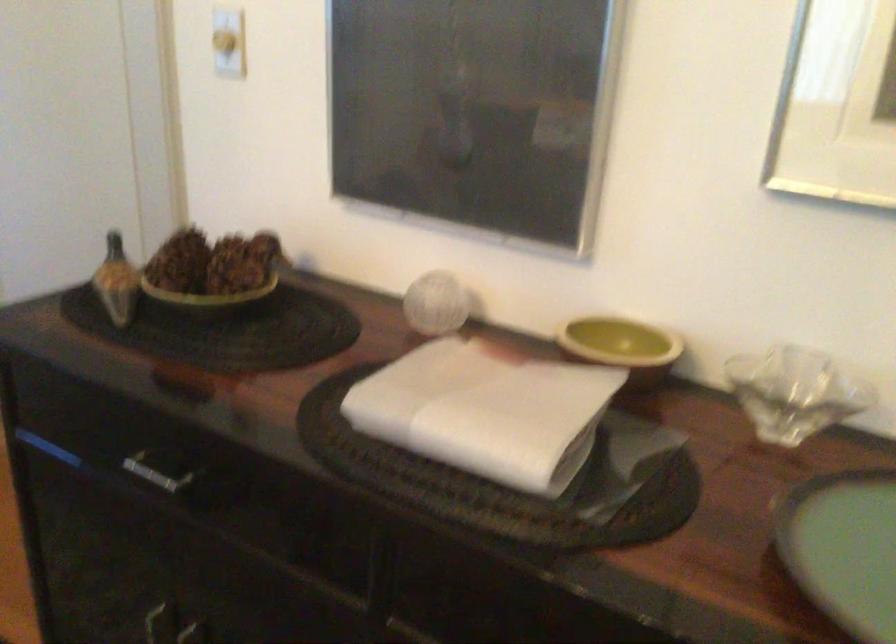
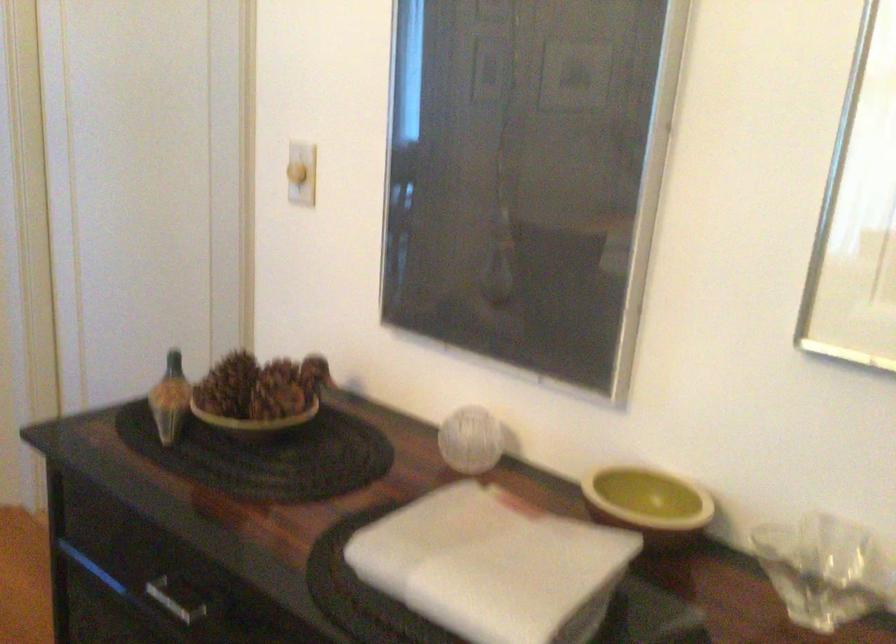
The point at (616, 352) is marked in the first image. Where is the corresponding point in the second image?

(648, 503)